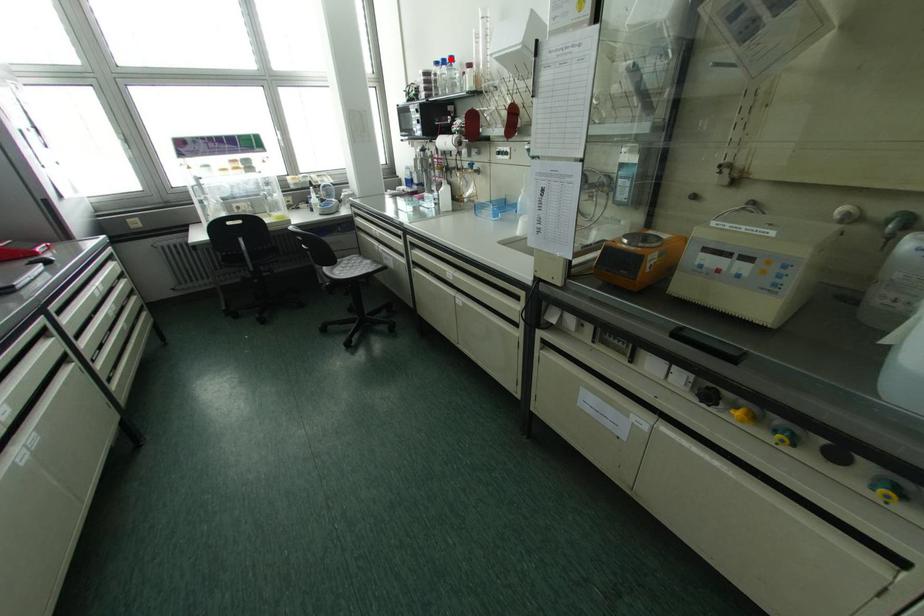
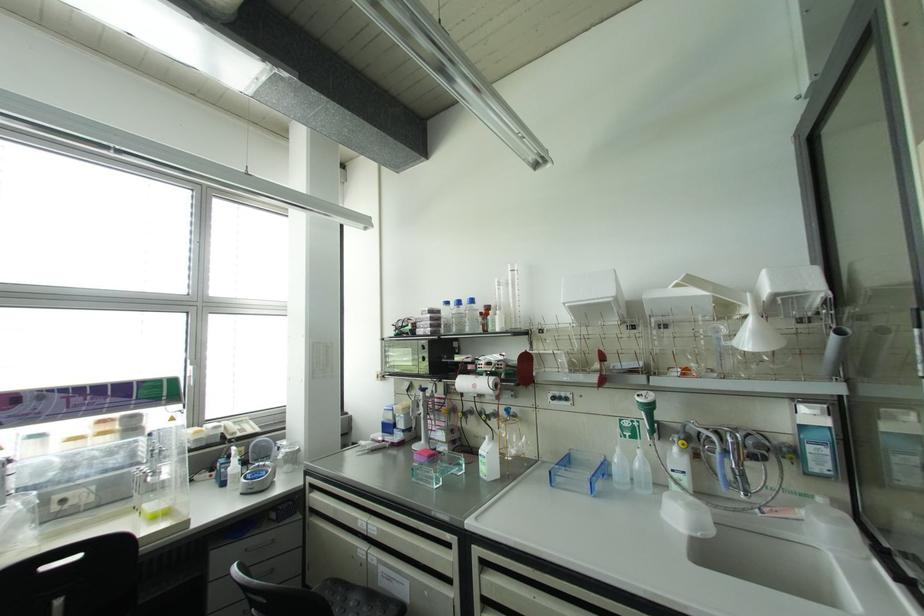
The point at the highlighted location is marked in the first image. Where is the corresponding point in the second image?

(471, 301)